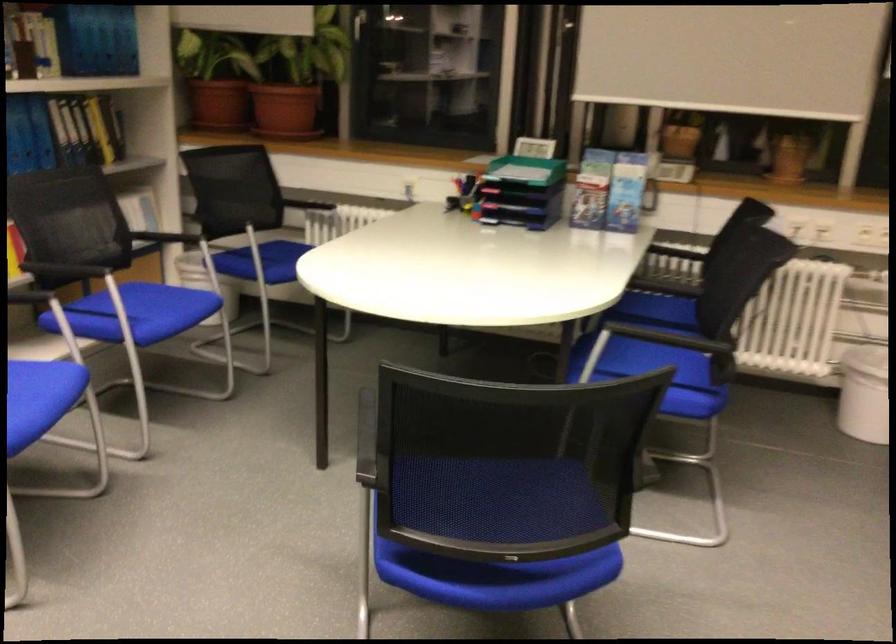
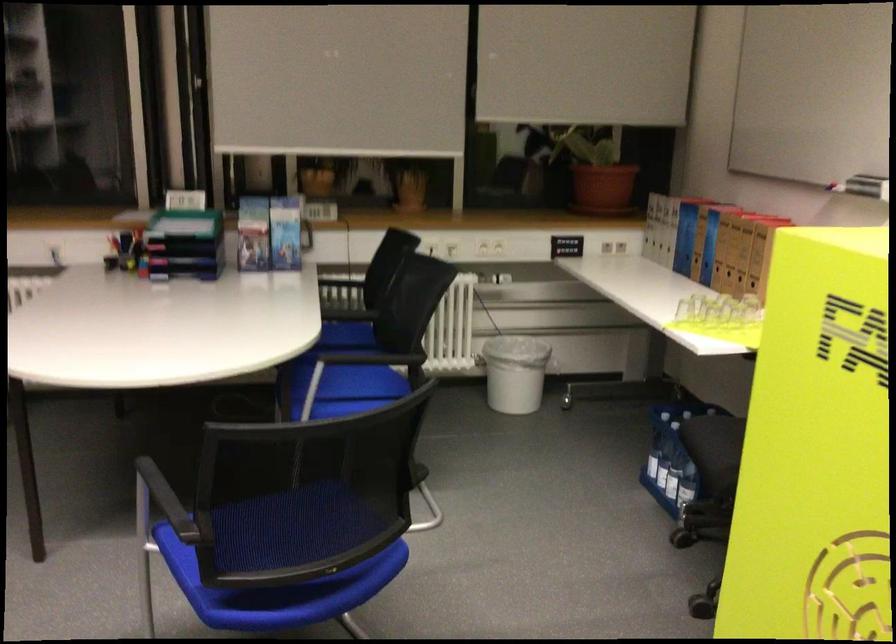
In the second image, find the point that corresponds to the point at 424,547 in the first image.

(261, 585)